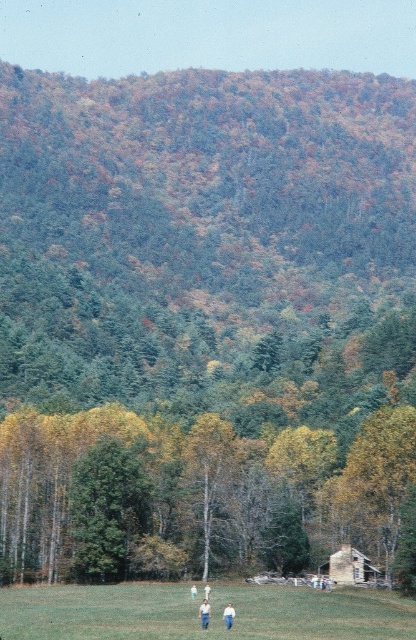
From the picture: Which is below, green grass at lower center or white cotton shirt at lower center?

Positioned lower is green grass at lower center.

Find the location of a particular element. The height and width of the screenshot is (640, 416). green grass at lower center is located at coordinates (198, 612).

This screenshot has height=640, width=416. Find the location of `green grass at lower center`. green grass at lower center is located at coordinates 198,612.

Which is in front, point (207, 604) or point (228, 609)?

Positioned in front is point (228, 609).

Who is higher up, blue jeans at lower center or white cotton shirt at lower center?

blue jeans at lower center is higher up.

Between point (207, 611) and point (232, 611), which one is positioned in front?

Point (232, 611)

What are the coordinates of `blue jeans at lower center` in the screenshot? It's located at (205, 612).

Is point (114, 636) closer to camera compared to point (193, 588)?

Yes, point (114, 636) is in front of point (193, 588).

Based on the photo, is green grass at lower center closer to the viewer compared to white cotton shirt at center?

Yes, it is in front of white cotton shirt at center.

The image size is (416, 640). Identify the location of green grass at lower center. (198, 612).